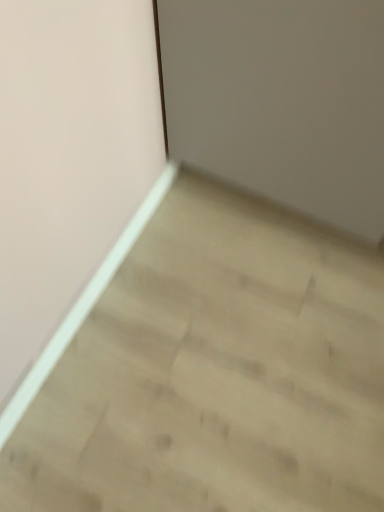
In order to face light wood plank at center, should I rotate leftwards or rightwards?

Rotate your view right by about 5.814°.

At what (x,y) coordinates should I click in order to perform the action: click on light wood plank at center. Please return your answer as a coordinate pair (x, y). Looking at the image, I should click on (216, 372).

The image size is (384, 512). What do you see at coordinates (216, 372) in the screenshot? I see `light wood plank at center` at bounding box center [216, 372].

Locate an element on the screen. The image size is (384, 512). light wood plank at center is located at coordinates (216, 372).